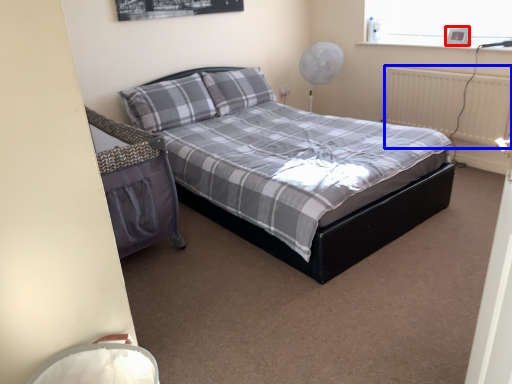
Question: Which of the following is the closest to the observer, picture frame (highlighted by a red box) or radiator (highlighted by a blue box)?

Choices:
 (A) picture frame
 (B) radiator

Answer: (B)